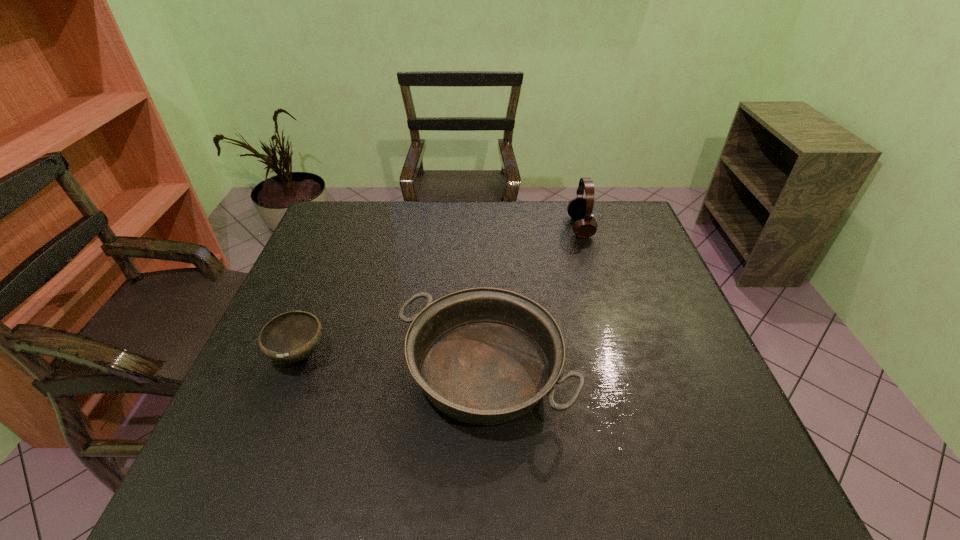
You are a GUI agent. You are given a task and a screenshot of the screen. Output one action in this format:
    pyautogui.click(x=<x>, y=<y>)
    Task: Click on the farthest object
    Image resolution: width=960 pixels, height=540 pixels.
    Given the screenshot: What is the action you would take?
    pyautogui.click(x=580, y=209)

Where is `headset`? Image resolution: width=960 pixels, height=540 pixels. headset is located at coordinates (580, 209).

You are a GUI agent. You are given a task and a screenshot of the screen. Output one action in this format:
    pyautogui.click(x=<x>, y=<y>)
    Task: Click on the pan
    The image size is (960, 540).
    Given the screenshot: What is the action you would take?
    pyautogui.click(x=485, y=356)

What are the coordinates of `the second tallest object` in the screenshot? It's located at (485, 356).

Where is `the shortest object`? The width and height of the screenshot is (960, 540). the shortest object is located at coordinates (290, 337).

You are a GUI agent. You are given a task and a screenshot of the screen. Output one action in this format:
    pyautogui.click(x=<x>, y=<y>)
    Task: Click on the bowl
    Image resolution: width=960 pixels, height=540 pixels.
    Given the screenshot: What is the action you would take?
    pyautogui.click(x=290, y=337)

Where is `free space located on the ear pads of the headset`? The width and height of the screenshot is (960, 540). free space located on the ear pads of the headset is located at coordinates (535, 227).

You are a GUI agent. You are given a task and a screenshot of the screen. Output one action in this format:
    pyautogui.click(x=<x>, y=<y>)
    Task: Click on the free space located 0.280m on the ear pads of the headset
    
    Given the screenshot: What is the action you would take?
    pyautogui.click(x=483, y=227)

The image size is (960, 540). I want to click on free space located on the ear pads of the headset, so click(501, 227).

Where is `free point located on the front of the second object from left to right`? The height and width of the screenshot is (540, 960). free point located on the front of the second object from left to right is located at coordinates [x=485, y=472].